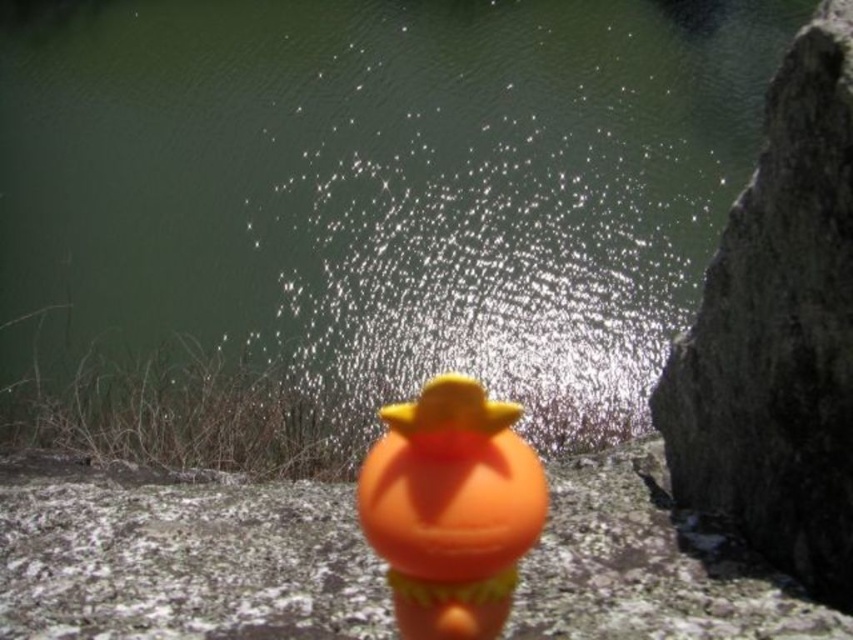
You are a photographer trying to capture the orange matte rubber duck at center in your shot. The green matte water at center is reflecting the duck. Where should you position your camera relative to the duck to ensure the reflection of the duck is visible in the water?

To capture the reflection of the orange matte rubber duck at center in the green matte water at center, position your camera directly above the duck and aligned with the water surface. Since the water is above the duck, the reflection would be visible when the camera is positioned at the same level as the water, facing downward towards the duck.

You are a photographer trying to capture the reflection of the orange rubber duck toy in the green matte water at center. Since the gray rough rock at right is in the way, can you still get a clear reflection of the duck in the water?

The green matte water at center has a greater height compared to gray rough rock at right, so the water is deeper there. This means the duck can float lower, allowing its reflection to be clearer in the green matte water at center despite the gray rough rock at right being nearby.